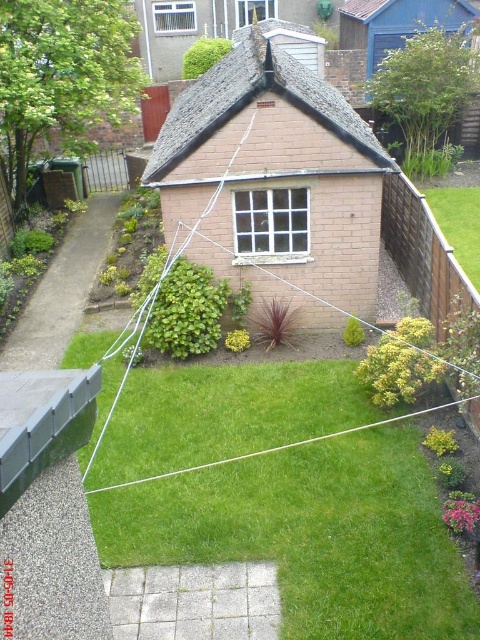
You are a gardener who needs to water two sections of green grass at center and green grass at right. The watering hose is 6 meters long. Can you reach both sections without moving the hose? Please explain your reasoning.

The green grass at center and green grass at right are 6.17 meters apart. Since the hose is only 6 meters long, it is 0.17 meters shorter than needed. Therefore, you cannot reach both sections without moving the hose.

You are planning to plant a new flower bed in the garden. You have two areas to choose from, one is the green grass at center and the other is the green grass at right. Which area has more space for planting?

The green grass at center has more space for planting since it is larger in size than the green grass at right.